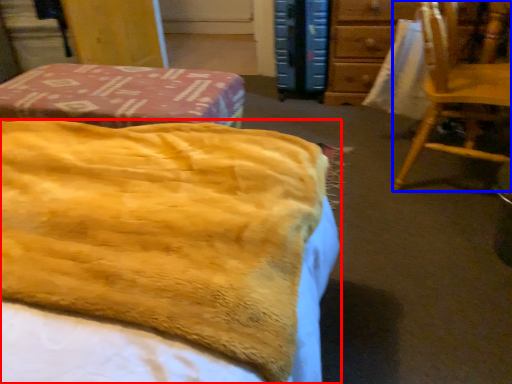
Question: Which object appears closest to the camera in this image, bed (highlighted by a red box) or chair (highlighted by a blue box)?

Choices:
 (A) bed
 (B) chair

Answer: (A)